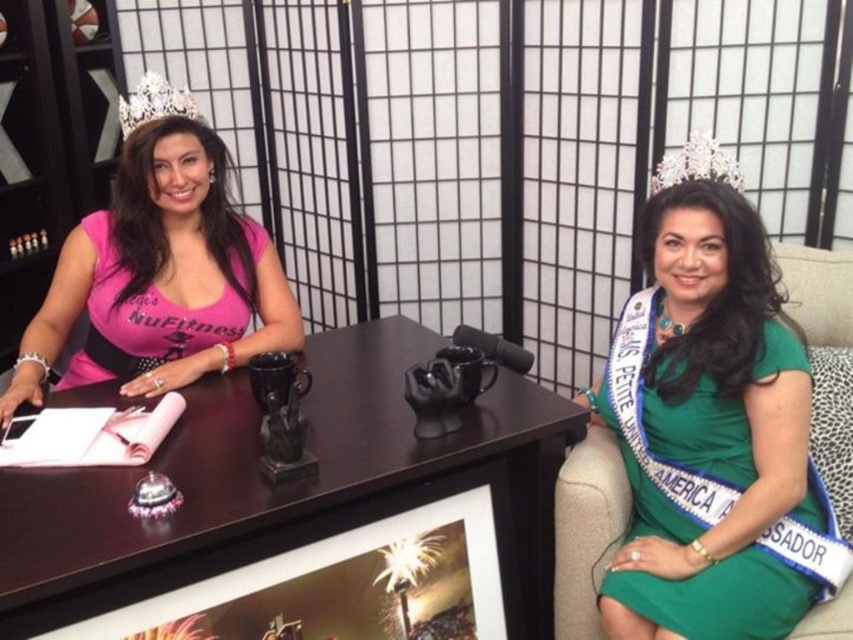
Is green satin dress at center positioned before silver metallic crown at upper left?

Yes, green satin dress at center is in front of silver metallic crown at upper left.

Between point (775, 545) and point (144, 104), which one is positioned in front?

Point (775, 545)

Who is more distant from viewer, (x=671, y=586) or (x=122, y=97)?

The point (x=122, y=97) is more distant.

Where is `green satin dress at center`? This screenshot has width=853, height=640. green satin dress at center is located at coordinates click(x=712, y=435).

Is matte black table at center in front of green satin dress at center?

Yes, it is.

Find the location of a particular element. matte black table at center is located at coordinates coord(289,486).

Between point (93, 364) and point (189, 115), which one is positioned in front?

Point (189, 115) is in front.

Based on the photo, can you confirm if pink matte t-shirt at left is shorter than silver metallic crown at upper left?

Incorrect, pink matte t-shirt at left's height does not fall short of silver metallic crown at upper left's.

Who is more forward, (148, 316) or (129, 106)?

Point (129, 106) is more forward.

Where is `pink matte t-shirt at left`? The height and width of the screenshot is (640, 853). pink matte t-shirt at left is located at coordinates (142, 320).